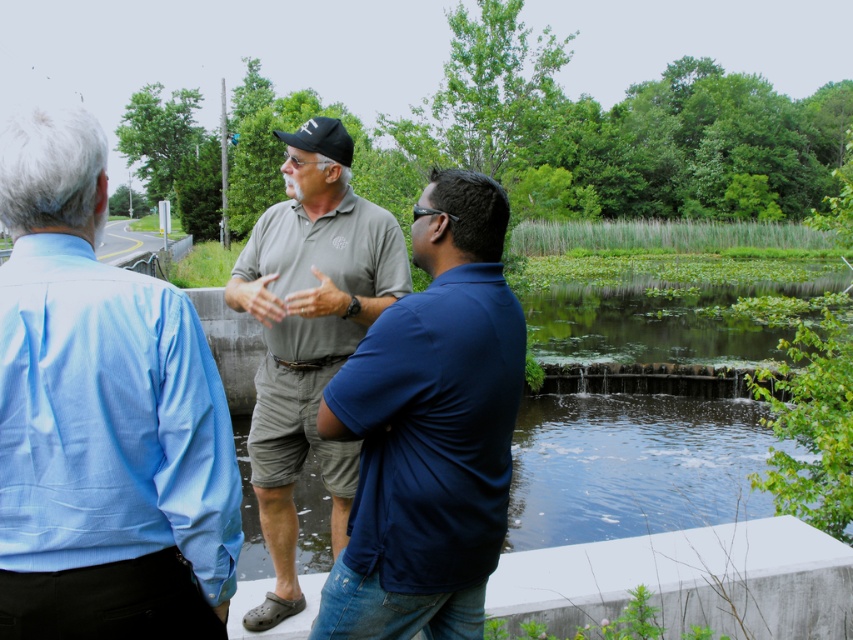
Question: Observing the image, what is the correct spatial positioning of matte green shirt at center in reference to matte gray polo shirt at center?

Choices:
 (A) above
 (B) below

Answer: (B)

Question: Is matte green shirt at center bigger than matte gray polo shirt at center?

Choices:
 (A) no
 (B) yes

Answer: (A)

Question: Among these objects, which one is farthest from the camera?

Choices:
 (A) matte gray polo shirt at center
 (B) matte green polo shirt at center
 (C) matte green shirt at center

Answer: (A)

Question: Observing the image, what is the correct spatial positioning of matte green polo shirt at center in reference to matte green shirt at center?

Choices:
 (A) below
 (B) above

Answer: (B)

Question: Which point is farther to the camera?

Choices:
 (A) (369, 301)
 (B) (1, 164)
 (C) (405, 602)

Answer: (A)

Question: Which of the following is the farthest from the observer?

Choices:
 (A) (26, 589)
 (B) (300, 305)

Answer: (B)